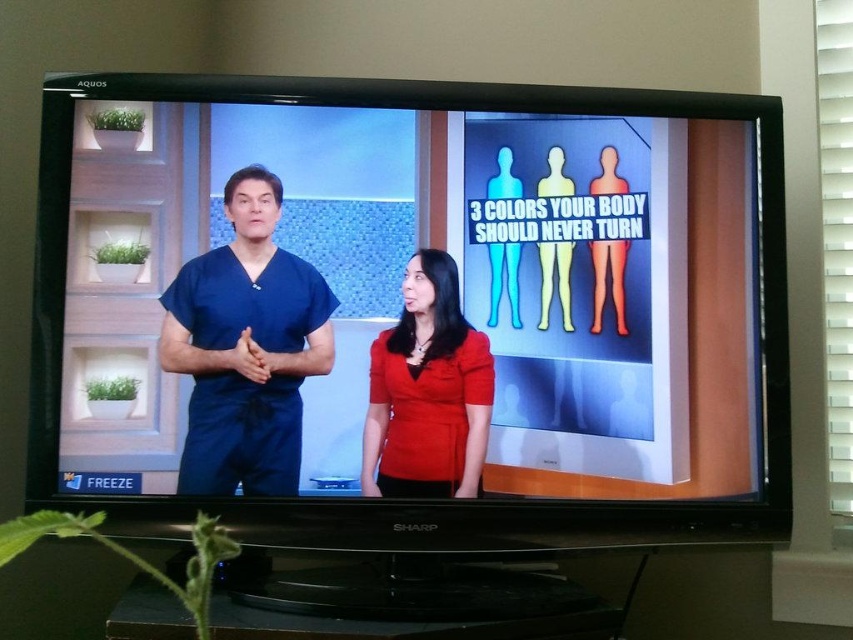
You are a medical student who needs to locate the exact position of the matte blue scrubs at center on the TV screen. What are the coordinates where they are displayed?

The coordinates for the matte blue scrubs at center are at point (408, 257).

You are a guest speaker at a medical conference and need to present on the TV screen. You see the matte blue scrubs at left and the matte red blouse at center. Which clothing item is positioned closer to the front of the screen?

The matte blue scrubs at left is closer to the viewer than the matte red blouse at center, so it is positioned closer to the front of the screen.

You are a medical student watching the TV screen. You notice the matte blue scrubs at left and the matte red blouse at center. Which of these two items is positioned higher on the screen?

The matte blue scrubs at left is much taller than the matte red blouse at center, so it is positioned higher on the screen.